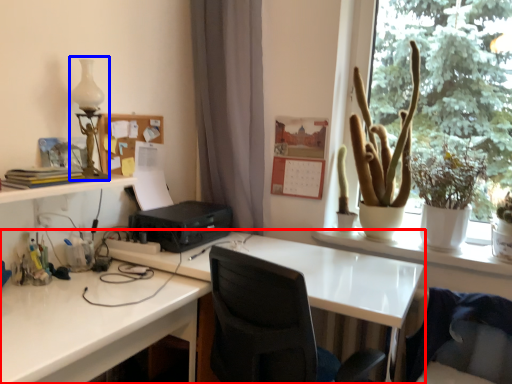
Question: Which of the following is the closest to the observer, desk (highlighted by a red box) or table lamp (highlighted by a blue box)?

Choices:
 (A) desk
 (B) table lamp

Answer: (A)